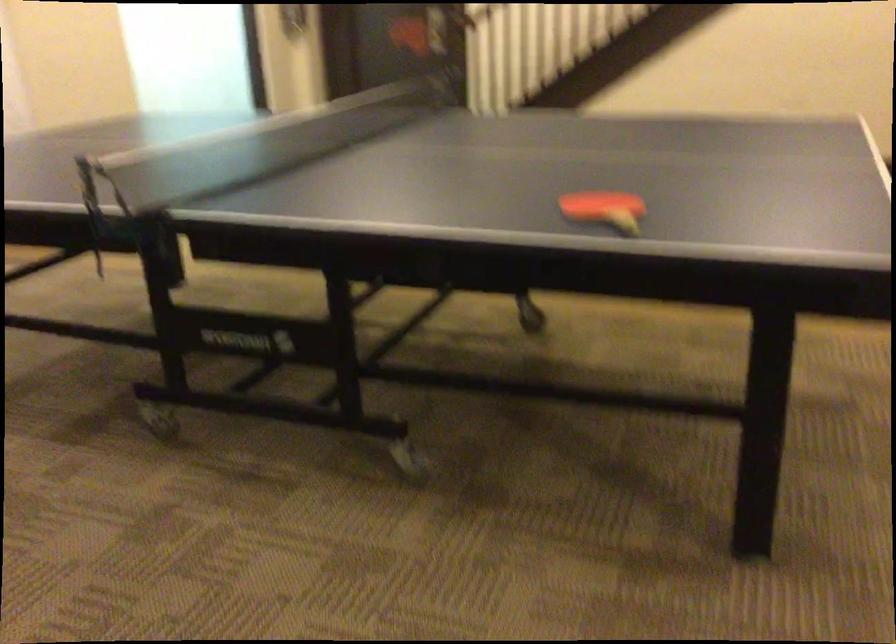
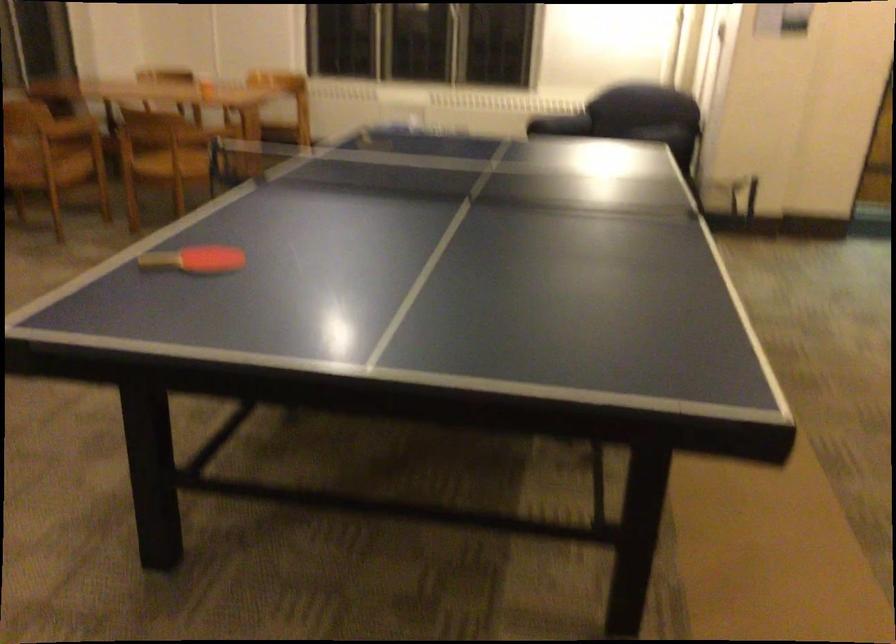
Where in the second image is the point corresponding to (602,192) from the first image?

(194, 259)